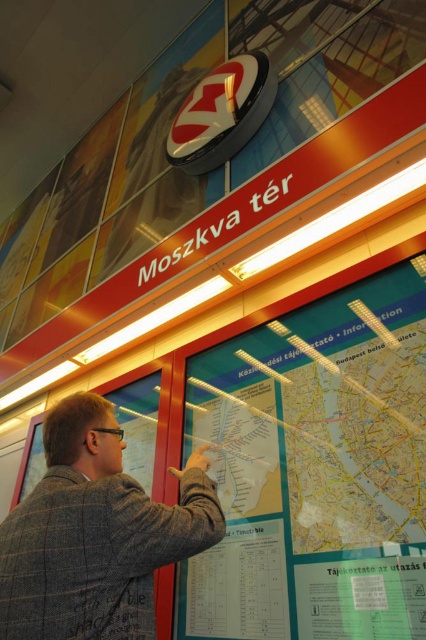
You are a visitor at the station and want to check the transit map to plan your route. Can you confirm if the matte plastic map at center is big enough to see the details clearly compared to the gray woolen jacket at center?

The matte plastic map at center is larger in size than the gray woolen jacket at center, so it should be big enough to see the details clearly.

You are a tour guide holding a 12 inch ruler and need to measure the distance between the matte plastic map at center and the gray woolen jacket at center. What is the measured distance?

The measured distance between the matte plastic map at center and the gray woolen jacket at center is 18.42 inches.

You are a visitor at the station and want to check the transit map to plan your route. The matte plastic map at center and the gray woolen jacket at center are both in your view. Which object is wider?

The matte plastic map at center is wider than the gray woolen jacket at center.